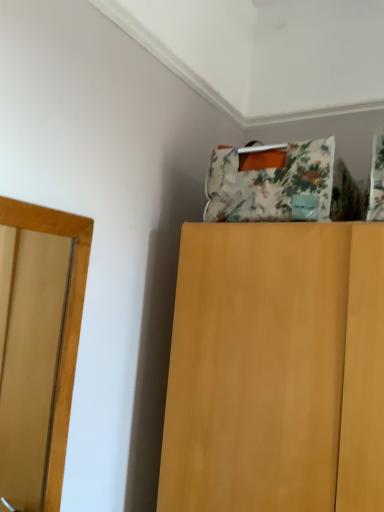
What do you see at coordinates (268, 183) in the screenshot? This screenshot has height=512, width=384. I see `floral fabric bag at upper center` at bounding box center [268, 183].

This screenshot has width=384, height=512. What are the coordinates of `floral fabric bag at upper center` in the screenshot? It's located at (268, 183).

This screenshot has width=384, height=512. I want to click on floral fabric bag at upper center, so click(268, 183).